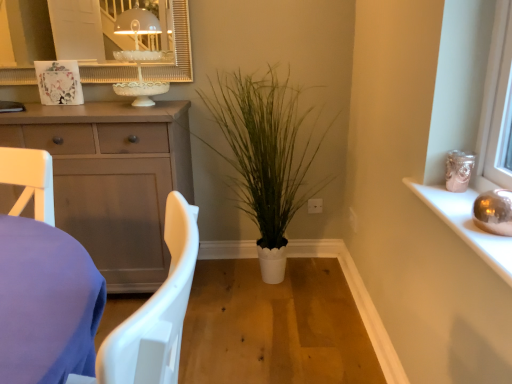
Question: Is white textured mirror at upper center surrounding matte gray cabinet at left?

Choices:
 (A) yes
 (B) no

Answer: (B)

Question: Is white textured mirror at upper center looking in the opposite direction of matte gray cabinet at left?

Choices:
 (A) yes
 (B) no

Answer: (B)

Question: Does white textured mirror at upper center come in front of matte gray cabinet at left?

Choices:
 (A) no
 (B) yes

Answer: (A)

Question: Can we say white textured mirror at upper center lies outside matte gray cabinet at left?

Choices:
 (A) no
 (B) yes

Answer: (B)

Question: Is white textured mirror at upper center at the right side of matte gray cabinet at left?

Choices:
 (A) no
 (B) yes

Answer: (B)

Question: Considering the positions of matte gray cabinet at left and white matte plant at center in the image, is matte gray cabinet at left taller or shorter than white matte plant at center?

Choices:
 (A) short
 (B) tall

Answer: (A)

Question: Is matte gray cabinet at left wider or thinner than white matte plant at center?

Choices:
 (A) thin
 (B) wide

Answer: (A)

Question: In terms of size, does matte gray cabinet at left appear bigger or smaller than white matte plant at center?

Choices:
 (A) big
 (B) small

Answer: (A)

Question: From the image's perspective, is matte gray cabinet at left above or below white matte plant at center?

Choices:
 (A) above
 (B) below

Answer: (B)

Question: Considering the positions of point (16, 281) and point (186, 54), is point (16, 281) closer or farther from the camera than point (186, 54)?

Choices:
 (A) farther
 (B) closer

Answer: (B)

Question: From the image's perspective, relative to white textured mirror at upper center, is white plastic chair at lower left above or below?

Choices:
 (A) below
 (B) above

Answer: (A)

Question: Is white plastic chair at lower left bigger or smaller than white textured mirror at upper center?

Choices:
 (A) big
 (B) small

Answer: (A)

Question: In terms of width, does white plastic chair at lower left look wider or thinner when compared to white textured mirror at upper center?

Choices:
 (A) thin
 (B) wide

Answer: (B)

Question: Visually, is metallic silver sphere at upper right positioned to the left or to the right of matte gray cabinet at left?

Choices:
 (A) left
 (B) right

Answer: (B)

Question: From a real-world perspective, relative to matte gray cabinet at left, is metallic silver sphere at upper right vertically above or below?

Choices:
 (A) below
 (B) above

Answer: (B)